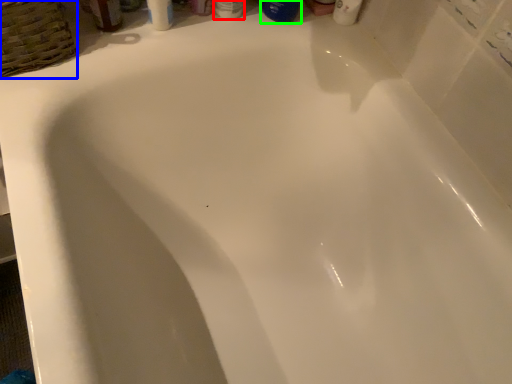
Question: Which object is the closest to the toiletry (highlighted by a red box)? Choose among these: basket (highlighted by a blue box) or mouthwash (highlighted by a green box).

Choices:
 (A) basket
 (B) mouthwash

Answer: (B)